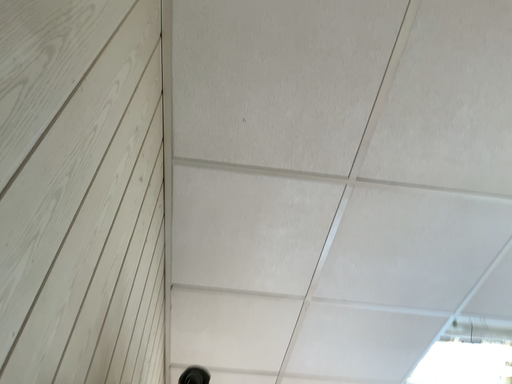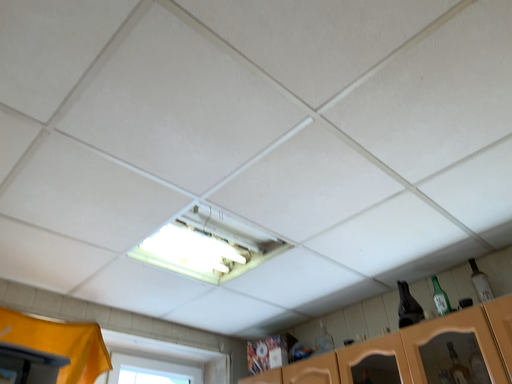
Question: How did the camera likely rotate when shooting the video?

Choices:
 (A) rotated left
 (B) rotated right

Answer: (B)